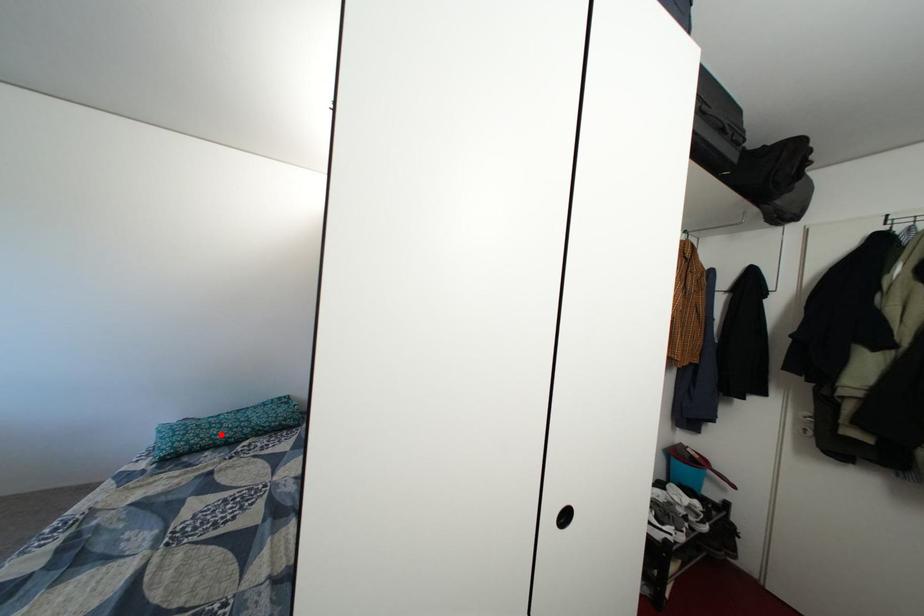
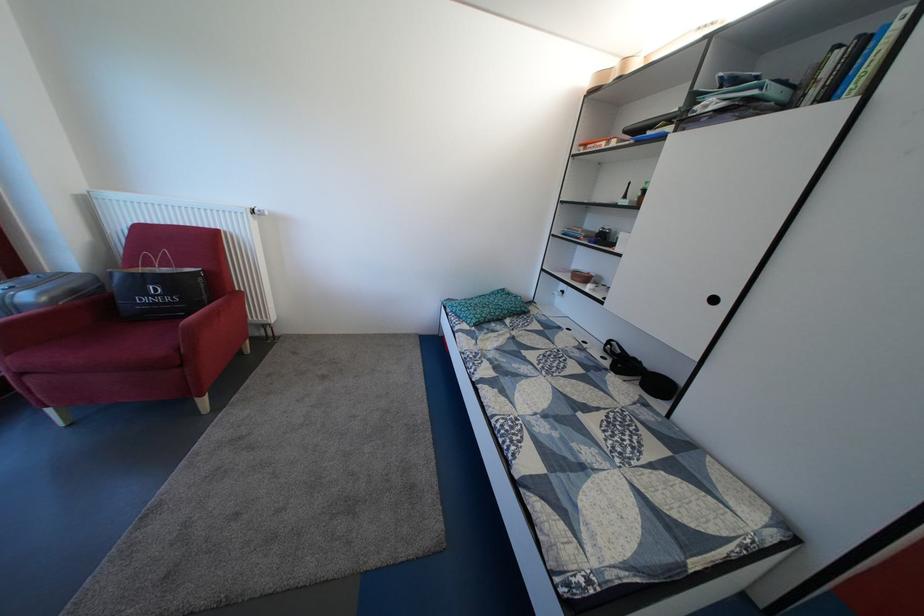
The point at the highlighted location is marked in the first image. Where is the corresponding point in the second image?

(494, 314)